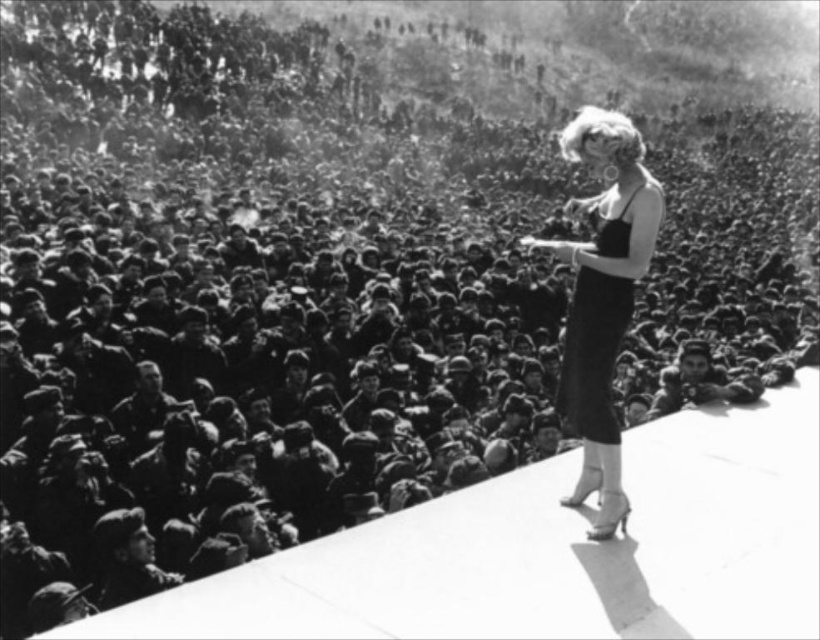
In order to click on black satin dress at center in this screenshot , I will do `click(602, 298)`.

Which is more to the right, black satin dress at center or satin black dress at upper right?

black satin dress at center is more to the right.

This screenshot has height=640, width=820. What do you see at coordinates (602, 298) in the screenshot?
I see `black satin dress at center` at bounding box center [602, 298].

Image resolution: width=820 pixels, height=640 pixels. Identify the location of black satin dress at center. tap(602, 298).